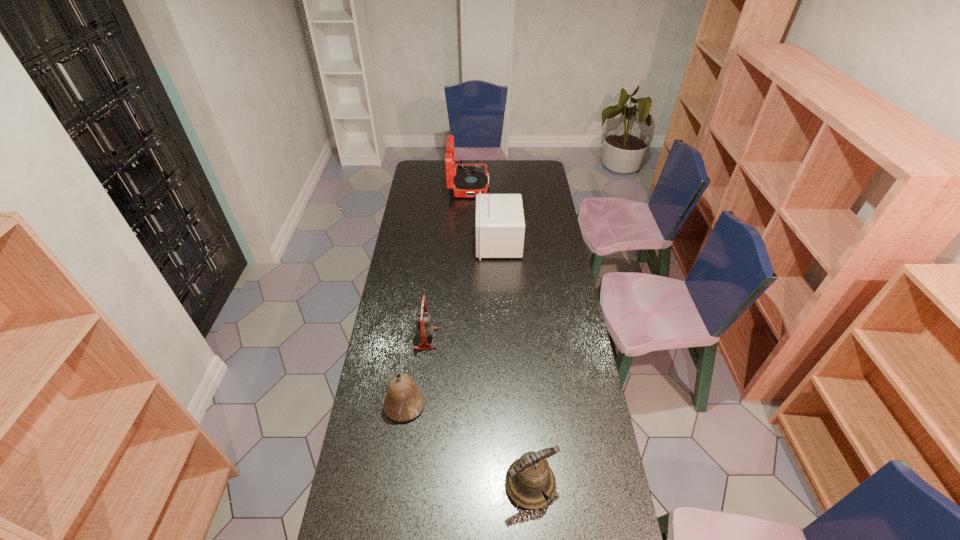
Identify the location of bell that is the second closest to the second farthest object. The width and height of the screenshot is (960, 540). (404, 401).

The height and width of the screenshot is (540, 960). I want to click on vacant space that satisfies the following two spatial constraints: 1. on the front-facing side of the nearest object; 2. on the left side of the fourth nearest object, so click(x=510, y=484).

Find the location of a particular element. Image resolution: width=960 pixels, height=540 pixels. vacant space that satisfies the following two spatial constraints: 1. on the front-facing side of the nearest bell; 2. on the left side of the farthest object is located at coordinates (459, 484).